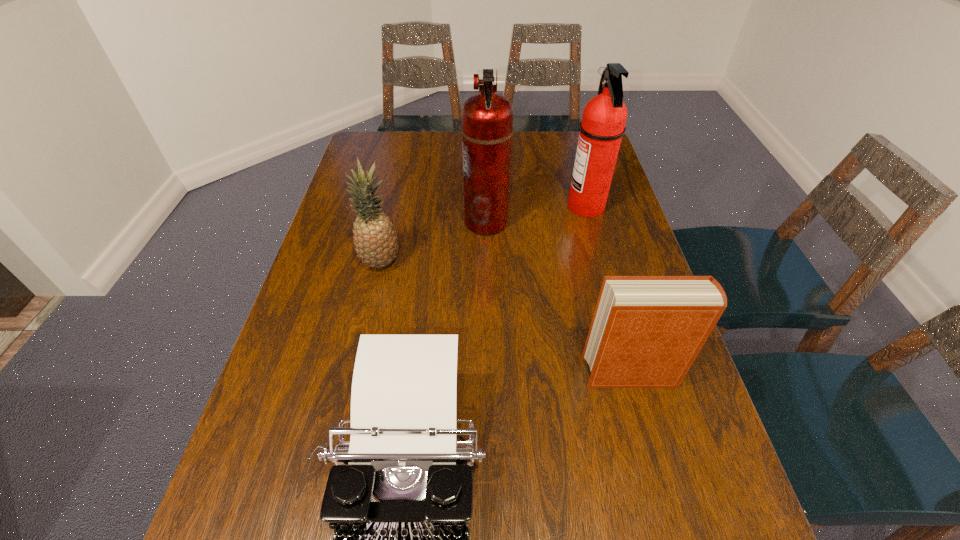
This screenshot has height=540, width=960. Find the location of `the left fire extinguisher`. the left fire extinguisher is located at coordinates (487, 118).

Locate an element on the screen. the right fire extinguisher is located at coordinates (602, 126).

Image resolution: width=960 pixels, height=540 pixels. What are the coordinates of `pineapple` in the screenshot? It's located at (375, 239).

The width and height of the screenshot is (960, 540). I want to click on hardback book, so click(646, 331).

You are a GUI agent. You are given a task and a screenshot of the screen. Output one action in this format:
    pyautogui.click(x=<x>, y=<y>)
    Task: Click on the vacant area situated 0.360m on the nozzle side of the left fire extinguisher
    The width and height of the screenshot is (960, 540).
    Given the screenshot: What is the action you would take?
    pyautogui.click(x=343, y=221)

Locate an element on the screen. This screenshot has height=540, width=960. free space located 0.160m on the nozzle side of the left fire extinguisher is located at coordinates (410, 221).

At what (x,y) coordinates should I click in order to perform the action: click on free space located 0.170m on the nozzle side of the left fire extinguisher. Please return your answer as a coordinate pair (x, y). Looking at the image, I should click on (407, 221).

At what (x,y) coordinates should I click in order to perform the action: click on vacant space located on the side of the right fire extinguisher near the handle. Please return your answer as a coordinate pair (x, y). Looking at the image, I should click on (521, 206).

This screenshot has width=960, height=540. Identify the location of free location located on the side of the right fire extinguisher near the handle. (547, 206).

The image size is (960, 540). What are the coordinates of `blank space located on the side of the right fire extinguisher near the handle` in the screenshot? It's located at (502, 206).